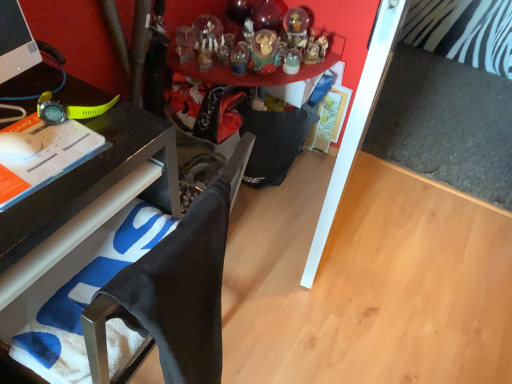
Locate an element on the screen. The image size is (512, 384). free spot above black glossy desk at left (from a real-world perspective) is located at coordinates (47, 135).